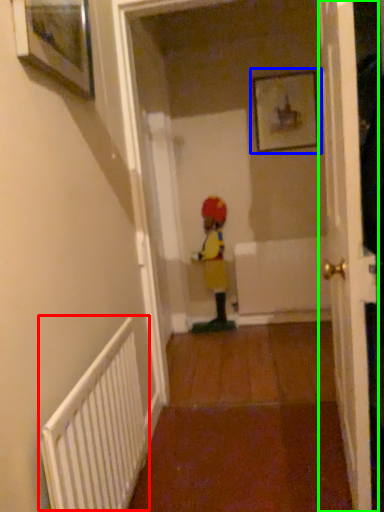
Question: Based on their relative distances, which object is farther from radiator (highlighted by a red box)? Choose from picture frame (highlighted by a blue box) and door (highlighted by a green box).

Choices:
 (A) picture frame
 (B) door

Answer: (A)